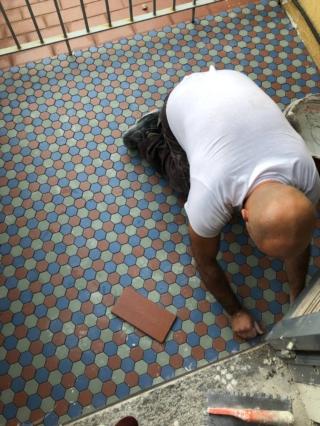
This screenshot has width=320, height=426. I want to click on handle (door), so click(x=288, y=353).